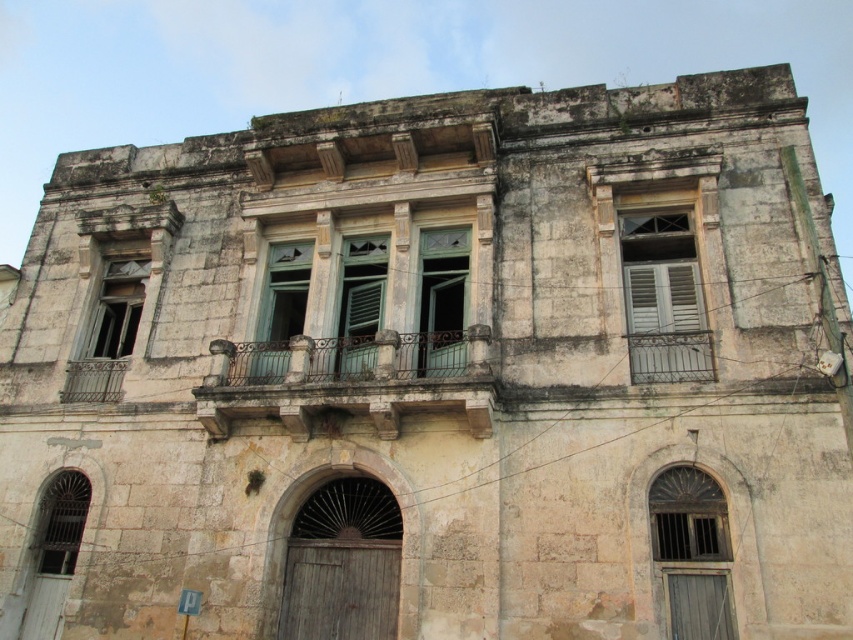
In the scene shown: You are standing in front of the old stone building and want to take a photo. You notice two points marked on the building. The first point is at coordinates point (354, 288) and the second is at point (73, 547). Which point is closer to your camera lens?

Point (73, 547) is closer to the camera lens because it is less further away than point (354, 288).

You are standing in front of the old stone building and want to enter through the door located between the white wooden window at upper right and the matte glass window at center left. Which window is closer to the door?

The matte glass window at center left is closer to the door because the white wooden window at upper right is positioned on the right side of the matte glass window at center left, meaning the matte glass window is between the door and the white wooden window.